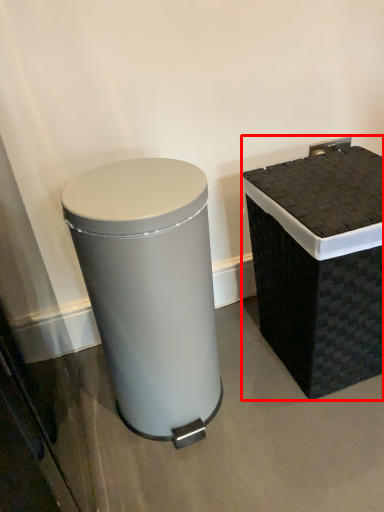
Question: From the image, what is the correct spatial relationship of waste container (annotated by the red box) in relation to waste container?

Choices:
 (A) left
 (B) right

Answer: (B)